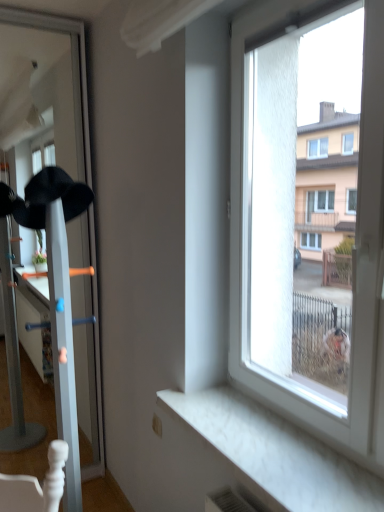
Question: Is black matte baseball hat at left inside the boundaries of white glossy coat rack at left, or outside?

Choices:
 (A) inside
 (B) outside

Answer: (A)

Question: Considering the positions of black matte baseball hat at left and white glossy coat rack at left in the image, is black matte baseball hat at left wider or thinner than white glossy coat rack at left?

Choices:
 (A) wide
 (B) thin

Answer: (B)

Question: Which object is positioned farthest from the white marble window sill at lower right?

Choices:
 (A) white glossy coat rack at left
 (B) black matte baseball hat at left

Answer: (A)

Question: Based on their relative distances, which object is farther from the white glossy coat rack at left?

Choices:
 (A) white marble window sill at lower right
 (B) black matte baseball hat at left

Answer: (A)